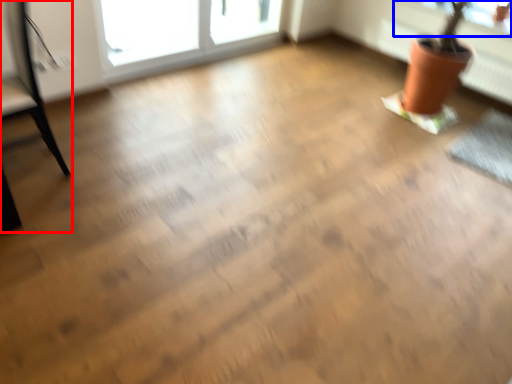
Question: Among these objects, which one is nearest to the camera, armchair (highlighted by a red box) or window screen (highlighted by a blue box)?

Choices:
 (A) armchair
 (B) window screen

Answer: (A)